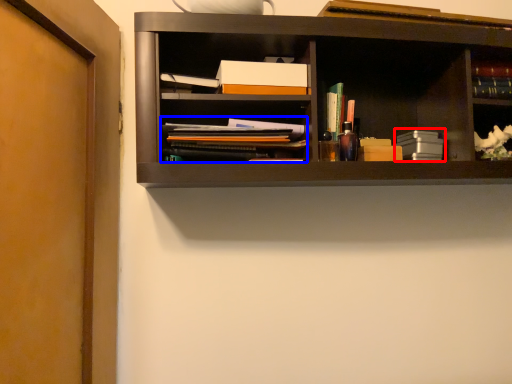
Question: Which of the following is the farthest to the observer, book (highlighted by a red box) or book (highlighted by a blue box)?

Choices:
 (A) book
 (B) book

Answer: (A)